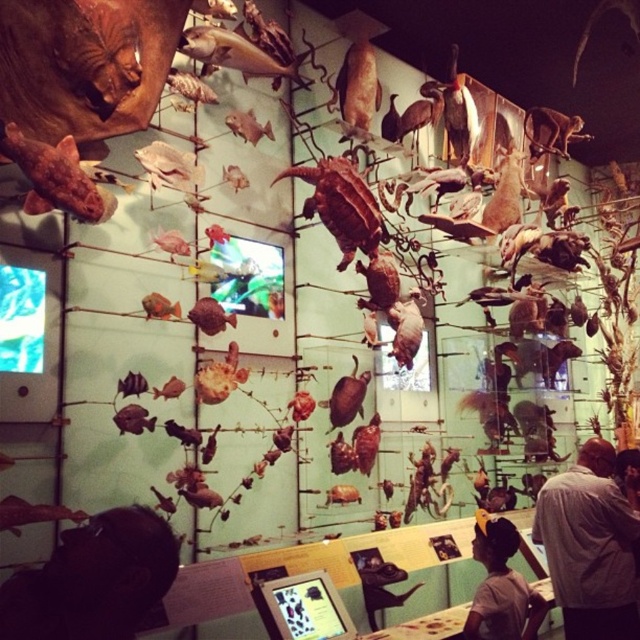
You are an art student observing the exhibit. You notice the gray shirt at lower right and the matte brown fish at upper left. Which object is positioned to the right of the other?

The gray shirt at lower right is positioned to the right of the matte brown fish at upper left.

You are an artist planning to sketch the scene. You notice the gray shirt at lower right and the matte brown fish at upper left. Which object should you focus on first if you want to draw the larger one first?

The gray shirt at lower right is bigger than the matte brown fish at upper left, so you should focus on drawing the gray shirt at lower right first.

You are standing in front of the exhibit and want to take a photo of the gray shirt at lower right without any specimens blocking it. Since the specimens are mounted on wires, can you estimate if the shirt is far enough away to avoid being obscured by the nearest specimen?

The gray shirt at lower right is 3.21 meters from the camera. Since the specimens are mounted on wires and the shirt is relatively far from the camera, it is likely that the shirt will not be obscured by the nearest specimen.